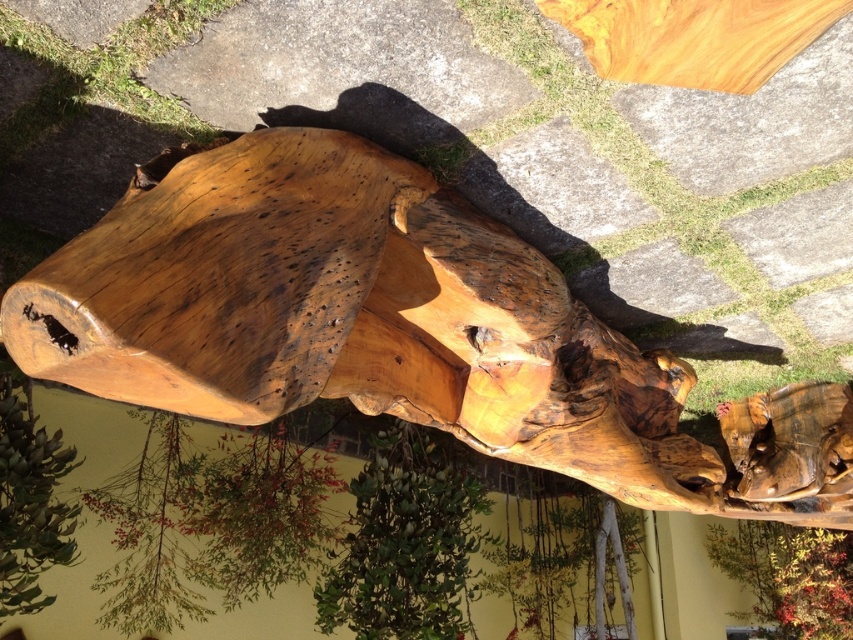
Based on the photo, you are sitting on the natural wood bench at center and want to look at the green matte tree at center. In which direction should you turn your head?

You should turn your head to the left to look at the green matte tree at center because the natural wood bench at center is to the right of the green matte tree at center.

You are planning to place a small potted plant between the natural wood bench at center and the green matte tree at center. Given their sizes, which object should the potted plant be closer to?

The natural wood bench at center is larger than the green matte tree at center, so the potted plant should be placed closer to the green matte tree at center to maintain balance.

You are sitting on the natural wood bench at center and want to look at the natural wood tree trunk at center. In which direction should you turn your head to see it?

You should turn your head backward to see the natural wood tree trunk at center because it is behind the natural wood bench at center.